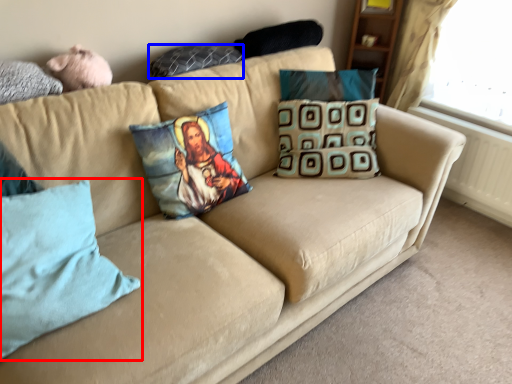
Question: Which object appears farthest to the camera in this image, pillow (highlighted by a red box) or pillow (highlighted by a blue box)?

Choices:
 (A) pillow
 (B) pillow

Answer: (B)